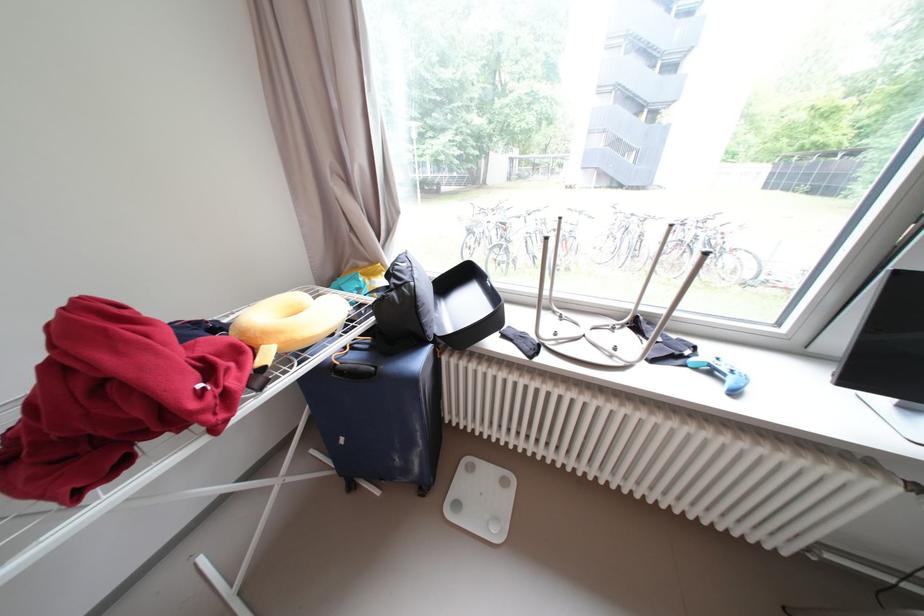
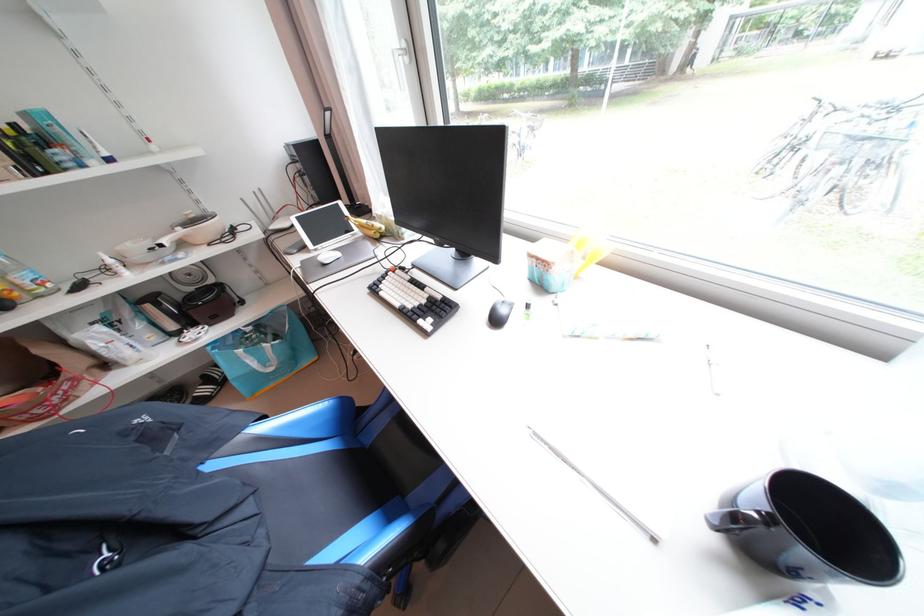
Which direction would the cameraman need to move to produce the second image?

The cameraman moved toward left, forward.